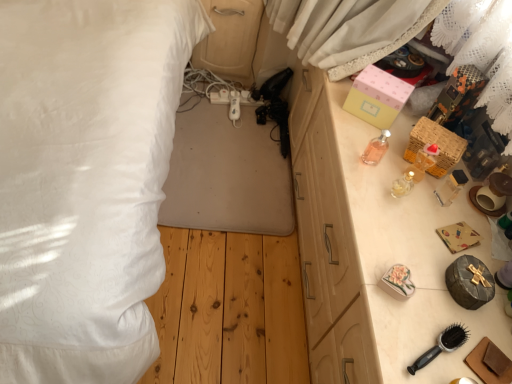
Identify the location of free space that is in between black plastic hairbrush at lower right and pink glass perfume at upper right. The height and width of the screenshot is (384, 512). (397, 253).